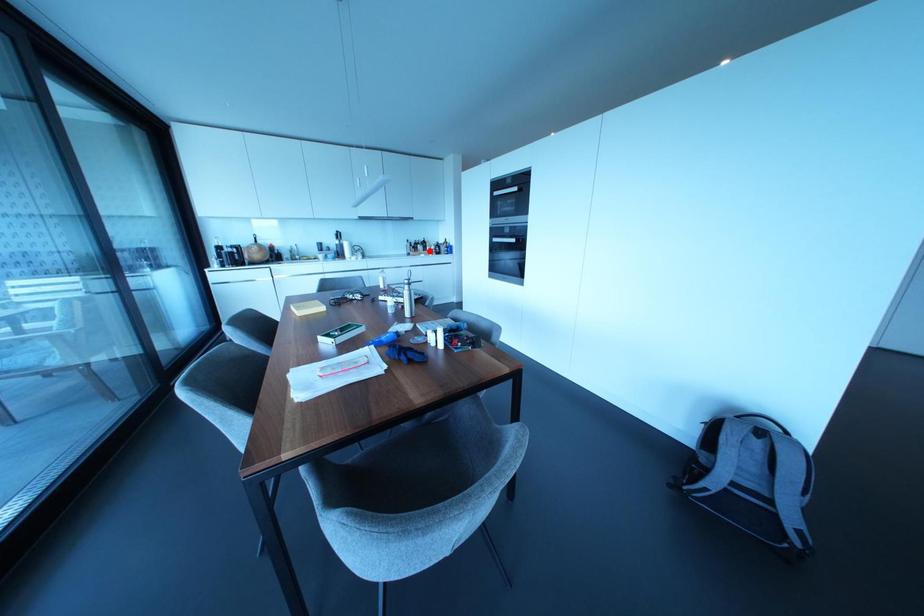
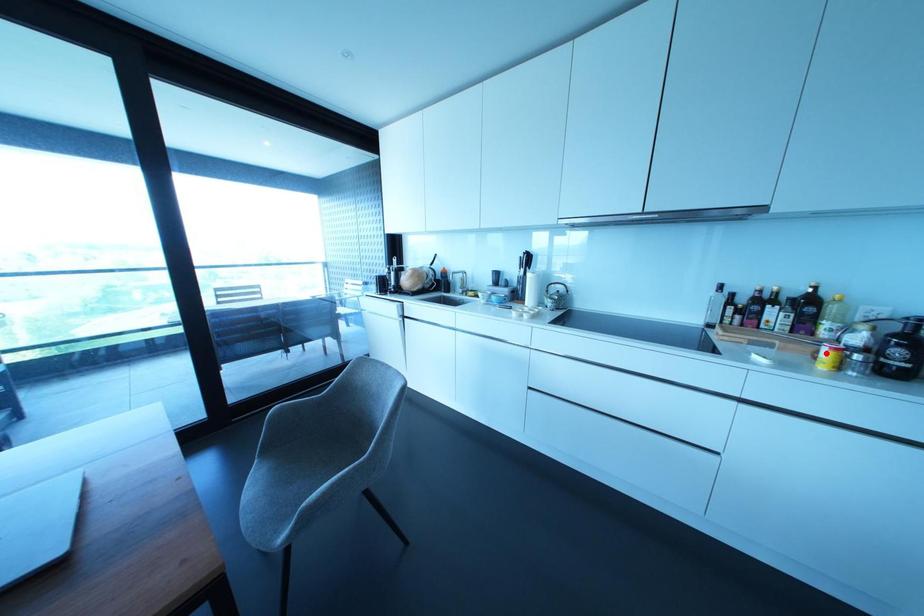
I am providing you with two images of the same scene from different viewpoints. A red point is marked on the first image and another point is marked on the second image. Does the point marked in image1 correspond to the same location as the one in image2?

Yes